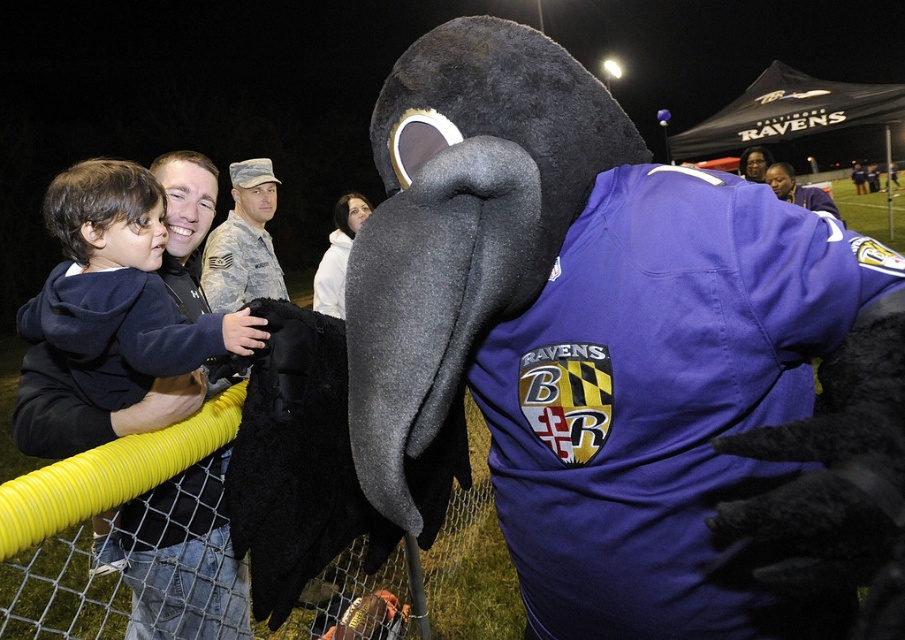
Who is shorter, fuzzy black mascot at center or dark blue hoodie at left?

dark blue hoodie at left

Is the position of fuzzy black mascot at center less distant than that of dark blue hoodie at left?

Yes, fuzzy black mascot at center is in front of dark blue hoodie at left.

Who is more forward, (783, 592) or (110, 285)?

Point (783, 592) is in front.

In order to click on fuzzy black mascot at center in this screenshot , I will do `click(621, 355)`.

Does dark blue hoodie at left lie in front of camouflage fabric uniform at center?

Yes, it is in front of camouflage fabric uniform at center.

Is dark blue hoodie at left above camouflage fabric uniform at center?

Actually, dark blue hoodie at left is below camouflage fabric uniform at center.

Is point (132, 177) positioned after point (215, 282)?

No.

At what (x,y) coordinates should I click in order to perform the action: click on dark blue hoodie at left. Please return your answer as a coordinate pair (x, y). Looking at the image, I should click on tap(121, 289).

Can you confirm if fuzzy black mascot at center is shorter than camouflage fabric uniform at center?

No, fuzzy black mascot at center is not shorter than camouflage fabric uniform at center.

Consider the image. Does fuzzy black mascot at center appear over camouflage fabric uniform at center?

Incorrect, fuzzy black mascot at center is not positioned above camouflage fabric uniform at center.

The width and height of the screenshot is (905, 640). I want to click on fuzzy black mascot at center, so click(x=621, y=355).